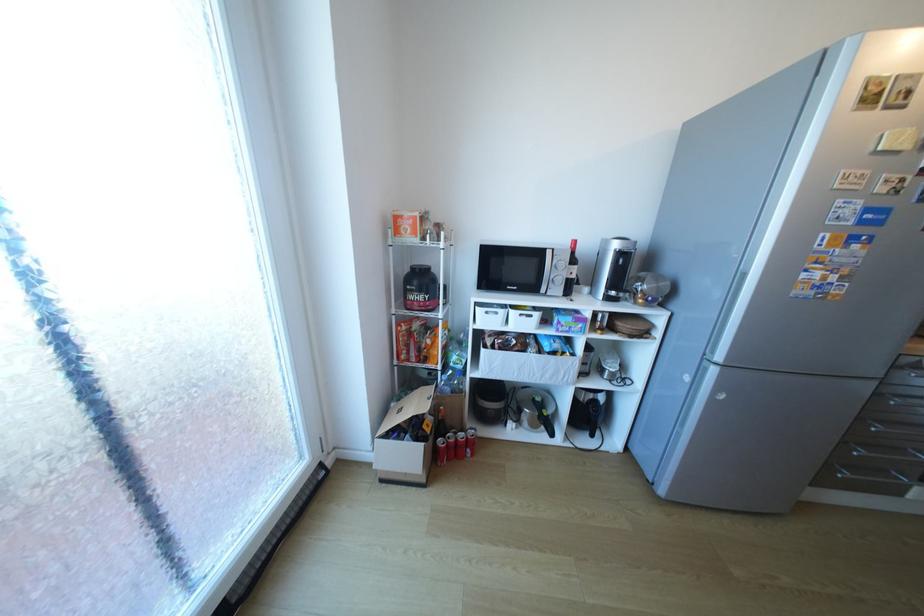
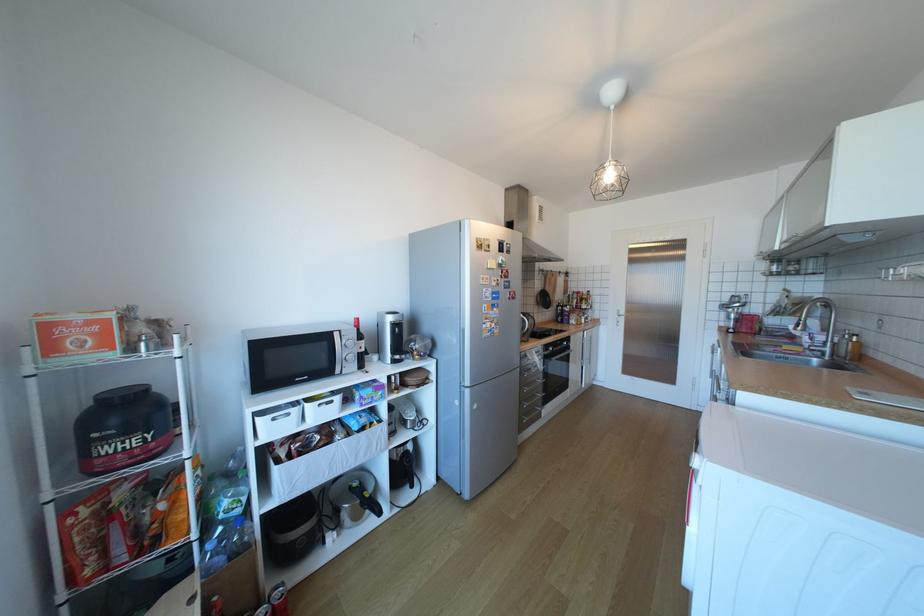
Locate, in the second image, the point that corresponds to pixel 416 233 in the first image.

(91, 346)